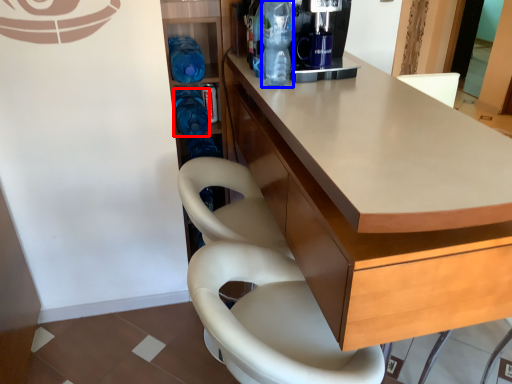
Question: Which object is closer to the camera taking this photo, bottle (highlighted by a red box) or bottle (highlighted by a blue box)?

Choices:
 (A) bottle
 (B) bottle

Answer: (B)